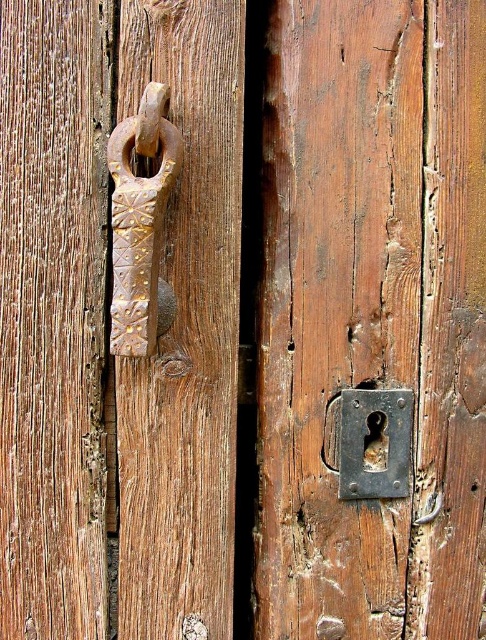
Is rusty metal door handle at left thinner than rusty metal keyhole at lower right?

Correct, rusty metal door handle at left's width is less than rusty metal keyhole at lower right's.

This screenshot has width=486, height=640. Describe the element at coordinates (140, 221) in the screenshot. I see `rusty metal door handle at left` at that location.

Find the location of `rusty metal door handle at left`. rusty metal door handle at left is located at coordinates (140, 221).

At what (x,y) coordinates should I click in order to perform the action: click on rusty metal door handle at left. Please return your answer as a coordinate pair (x, y). The height and width of the screenshot is (640, 486). Looking at the image, I should click on (140, 221).